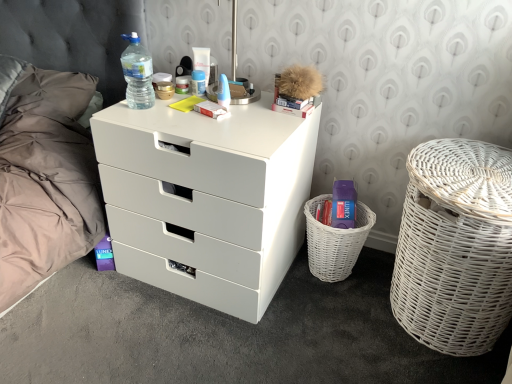
Identify the location of vacant space in between white wicker basket at lower right and white wicker basket at right. Image resolution: width=512 pixels, height=384 pixels. (347, 290).